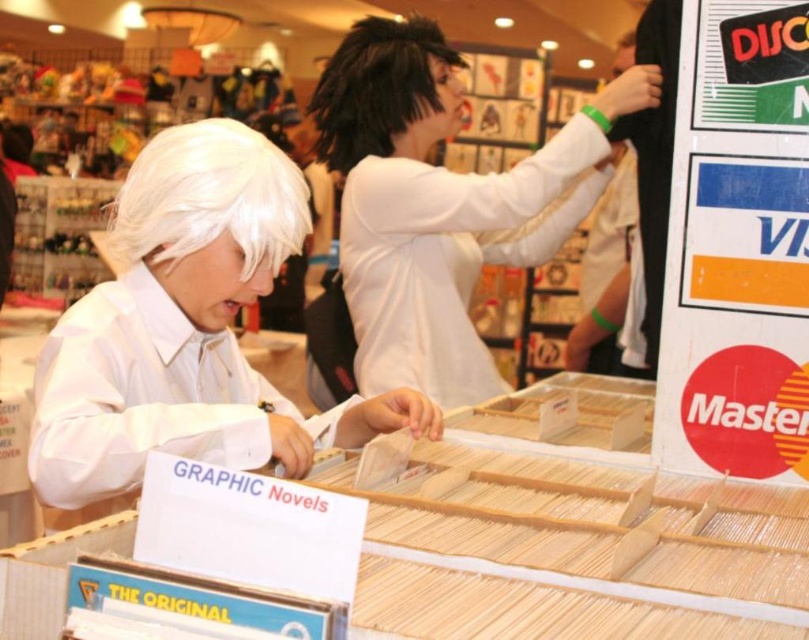
You are a customer in the bookstore looking for a specific wig to buy. You see the white synthetic wig at left and the slick black wig at upper center. Which wig is located lower in the display?

The white synthetic wig at left is positioned under the slick black wig at upper center, so the white synthetic wig at left is lower in the display.